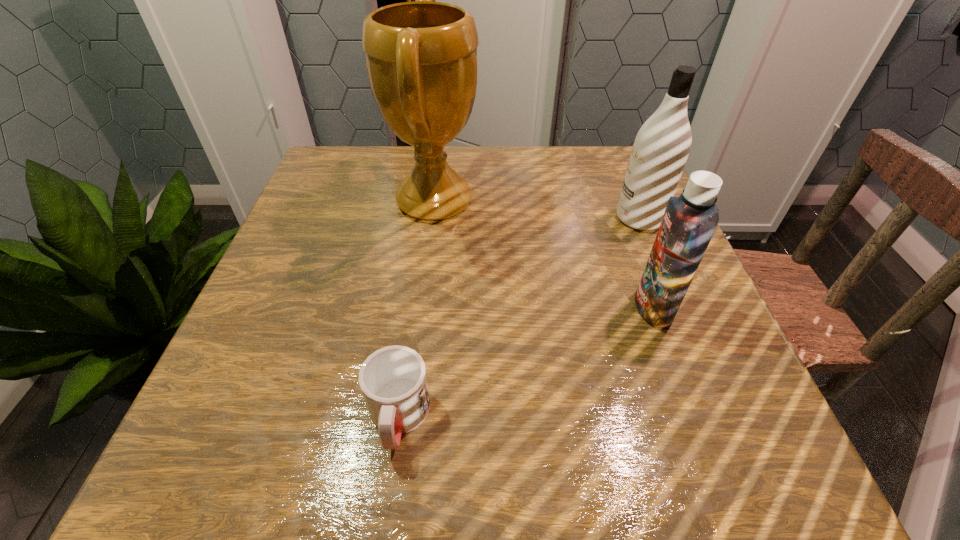
Image resolution: width=960 pixels, height=540 pixels. I want to click on award, so click(421, 57).

This screenshot has height=540, width=960. I want to click on the third shortest object, so click(661, 147).

In order to click on the taller shampoo in this screenshot , I will do `click(661, 147)`.

Where is `the second nearest object`? the second nearest object is located at coordinates (690, 220).

This screenshot has width=960, height=540. Identify the location of the nearer shampoo. (690, 220).

Locate an element on the screen. the shortest object is located at coordinates (393, 380).

What are the coordinates of `mug` in the screenshot? It's located at (393, 380).

Identify the location of blank space located 0.200m on the front of the tallest object with the decoration. (565, 201).

Locate an element on the screen. free point located on the front-facing side of the third shortest object is located at coordinates (471, 219).

You are a GUI agent. You are given a task and a screenshot of the screen. Output one action in this format:
    pyautogui.click(x=<x>, y=<y>)
    Task: Click on the vacant space located 0.310m on the front-facing side of the third shortest object
    The width and height of the screenshot is (960, 540).
    Given the screenshot: What is the action you would take?
    pyautogui.click(x=475, y=219)